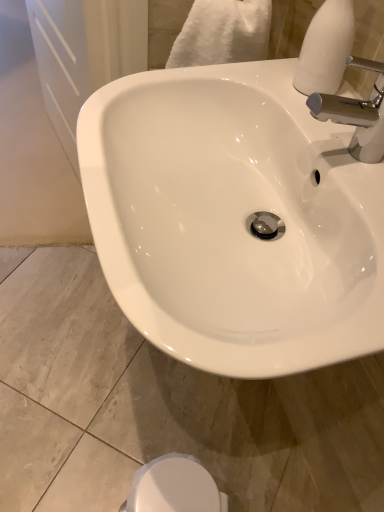
At what (x,y) coordinates should I click in order to perform the action: click on vacant area on the back side of white glossy bidet at lower center. Please return your answer as a coordinate pair (x, y). The width and height of the screenshot is (384, 512). Looking at the image, I should click on (173, 423).